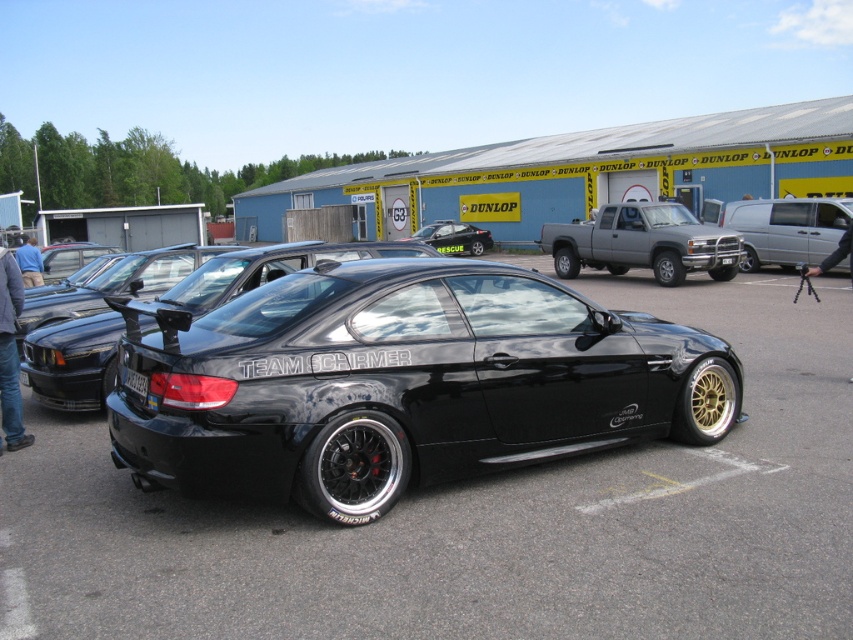
Based on the photo, you are a photographer positioned to the left of the matte black car at center and matte gray truck at center. You want to capture a photo that includes both vehicles. Which vehicle should you move towards to frame them properly?

Since the matte gray truck at center is to the right of the matte black car at center, you should move towards the matte black car at center to include both vehicles in your photo.